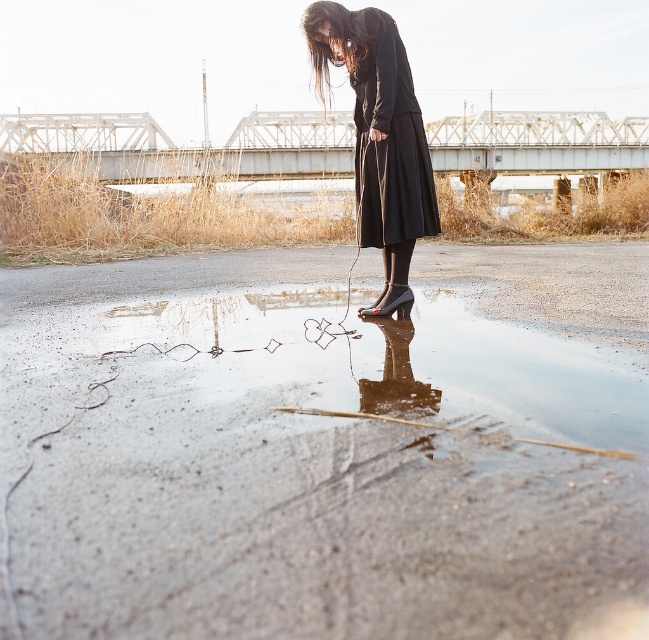
Question: Is glossy concrete puddle at center thinner than black matte dress at center?

Choices:
 (A) no
 (B) yes

Answer: (A)

Question: Estimate the real-world distances between objects in this image. Which object is closer to the black matte dress at center?

Choices:
 (A) glossy concrete puddle at center
 (B) matte black dress at center

Answer: (B)

Question: Estimate the real-world distances between objects in this image. Which object is closer to the glossy concrete puddle at center?

Choices:
 (A) matte black dress at center
 (B) black matte dress at center

Answer: (B)

Question: Based on their relative distances, which object is nearer to the black matte dress at center?

Choices:
 (A) matte black dress at center
 (B) glossy concrete puddle at center

Answer: (A)

Question: Is glossy concrete puddle at center positioned before black matte dress at center?

Choices:
 (A) no
 (B) yes

Answer: (B)

Question: Is glossy concrete puddle at center further to the viewer compared to matte black dress at center?

Choices:
 (A) yes
 (B) no

Answer: (B)